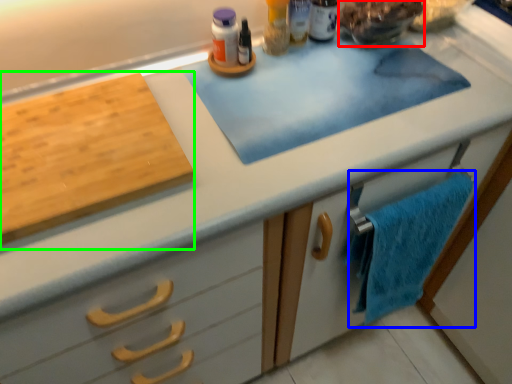
Question: Which object is positioned closest to food (highlighted by a red box)? Select from bath towel (highlighted by a blue box) and cutting board (highlighted by a green box).

Choices:
 (A) bath towel
 (B) cutting board

Answer: (A)